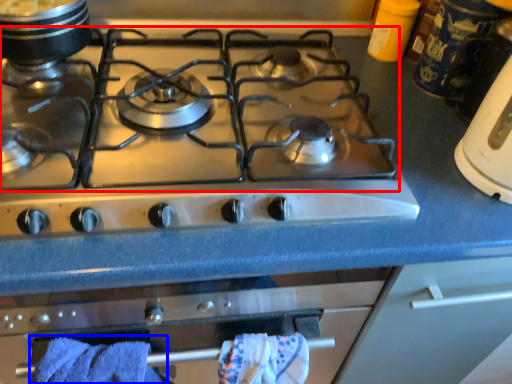
Question: Which object is closer to the camera taking this photo, gas stove (highlighted by a red box) or bath towel (highlighted by a blue box)?

Choices:
 (A) gas stove
 (B) bath towel

Answer: (A)